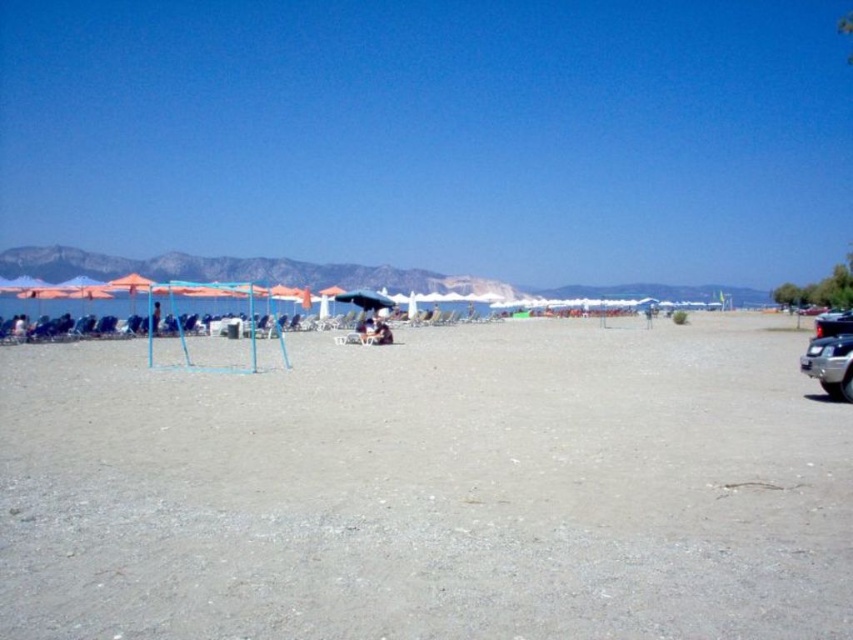
You are a photographer trying to capture a shot of the shiny black car at right without including the gray sand at center in the frame. Based on their positions, is this possible?

A: The gray sand at center is positioned on the left side of the shiny black car at right, so if you position yourself to the right of the car, you can avoid including the gray sand at center in your shot.

You are a photographer standing on the beach and want to take a photo of the blue denim shorts at center without the shiny black car at right appearing in the frame. Is this possible based on their positions?

The blue denim shorts at center is behind the shiny black car at right, so the car would block the view of the shorts. Therefore, it is not possible to take a photo of the blue denim shorts at center without the shiny black car at right appearing in the frame.

You are standing on the beach and want to place your beach towel exactly where the gray sand at center is located. According to the coordinates provided, what are the exact coordinates where you should place your beach towel?

The coordinates for the gray sand at center are at point (428,490).